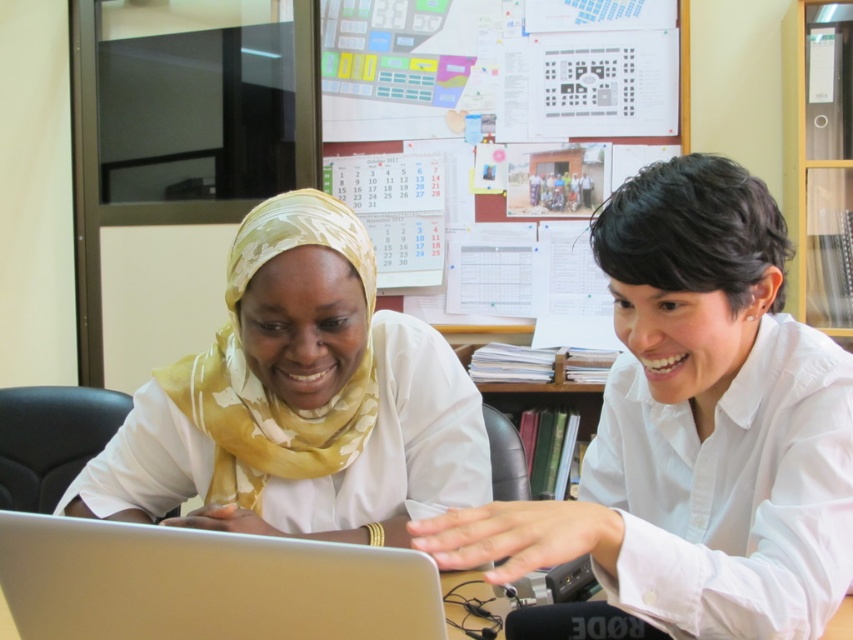
You are a tailor who needs to determine if the white smooth shirt at center can be folded and placed inside the silver metallic laptop at center. Based on the size comparison provided, what would you conclude?

The white smooth shirt at center is bigger than the silver metallic laptop at center, so it cannot be folded and placed inside the silver metallic laptop at center.

You are a photographer taking a picture of the scene. The white smooth shirt at center and the silver metallic laptop at center are both in the frame. Which object is positioned closer to the camera?

The white smooth shirt at center is closer to the viewer than the silver metallic laptop at center, so it is positioned closer to the camera.

You are an observer looking at the two people at the desk. Which of the two items, the white smooth shirt at center or the yellow floral scarf at center, is positioned higher on their bodies?

The white smooth shirt at center is positioned higher on their bodies than the yellow floral scarf at center because the white smooth shirt at center is above the yellow floral scarf at center.